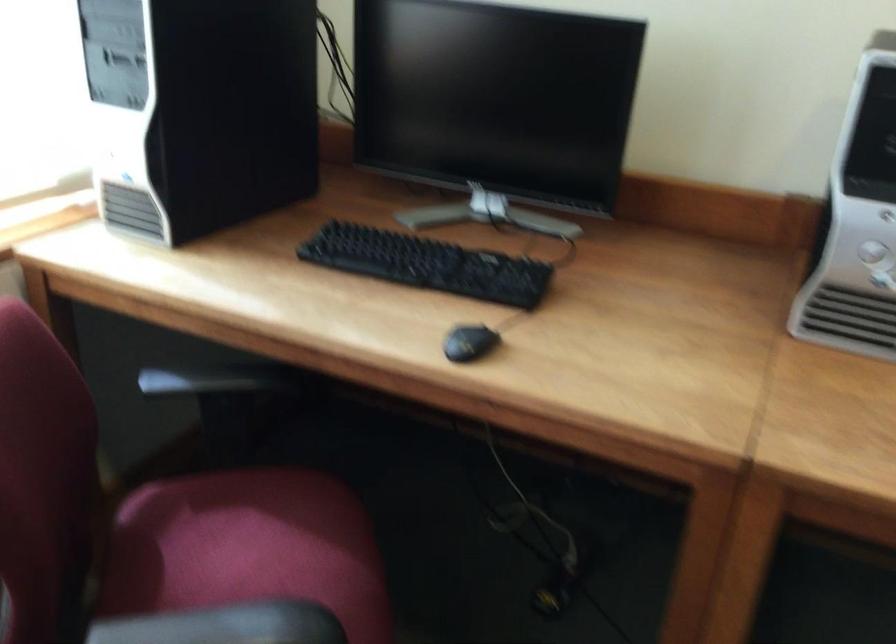
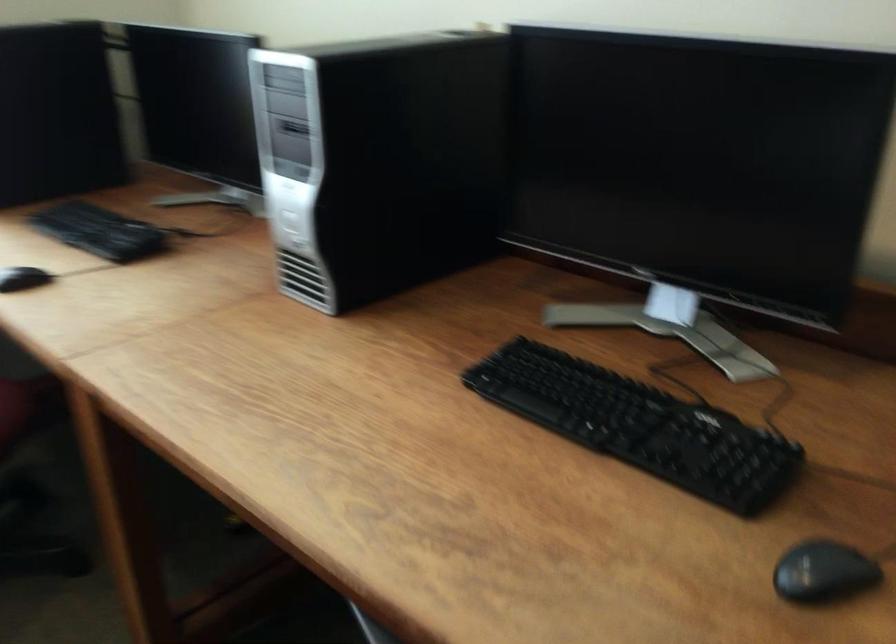
Question: What movement of the cameraman would produce the second image?

Choices:
 (A) Left
 (B) Right
 (C) Forward
 (D) Backward

Answer: (B)